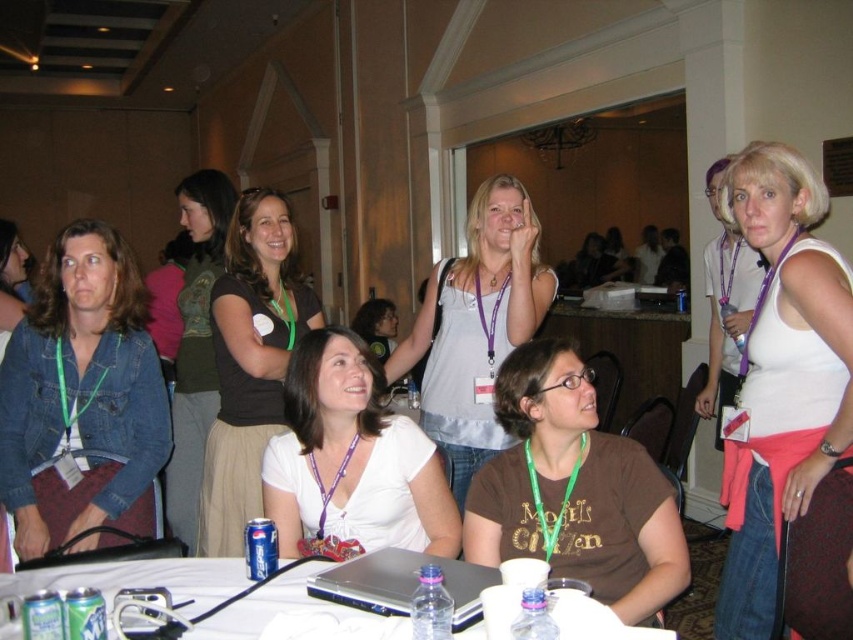
Can you confirm if matte black shirt at upper center is positioned to the left of dark green jersey at center?

No, matte black shirt at upper center is not to the left of dark green jersey at center.

Is matte black shirt at upper center above dark green jersey at center?

Yes.

Who is more forward, (230, 278) or (178, 451)?

Point (230, 278)

This screenshot has width=853, height=640. Identify the location of matte black shirt at upper center. (250, 362).

Does denim jacket at left have a lesser height compared to light gray tank top at center?

Yes.

Can you confirm if denim jacket at left is positioned above light gray tank top at center?

No.

Does point (67, 493) come in front of point (521, 196)?

Yes.

Where is `denim jacket at left`? This screenshot has height=640, width=853. denim jacket at left is located at coordinates (82, 397).

Does light gray tank top at center appear on the right side of matte black shirt at upper center?

Yes, light gray tank top at center is to the right of matte black shirt at upper center.

Who is taller, light gray tank top at center or matte black shirt at upper center?

matte black shirt at upper center

The width and height of the screenshot is (853, 640). What do you see at coordinates (476, 324) in the screenshot?
I see `light gray tank top at center` at bounding box center [476, 324].

Find the location of `light gray tank top at center`. light gray tank top at center is located at coordinates (476, 324).